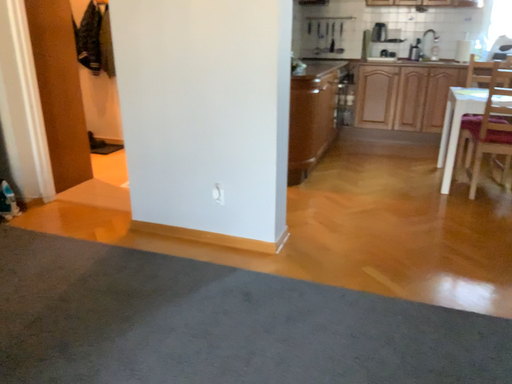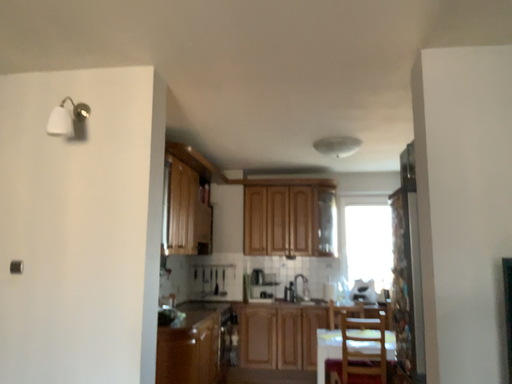
Question: How did the camera likely rotate when shooting the video?

Choices:
 (A) rotated right
 (B) rotated left

Answer: (A)